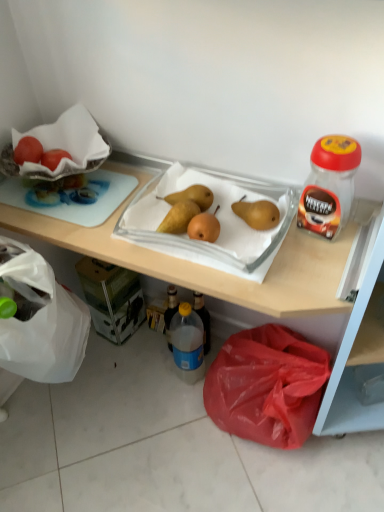
The width and height of the screenshot is (384, 512). I want to click on free space in front of matte white grapefruit at upper left, so click(64, 200).